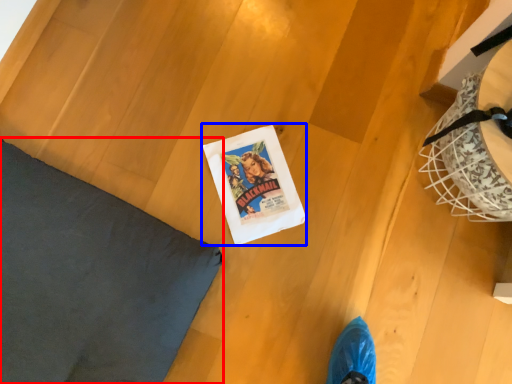
Question: Which object appears farthest to the camera in this image, pillow (highlighted by a red box) or comic book (highlighted by a blue box)?

Choices:
 (A) pillow
 (B) comic book

Answer: (B)